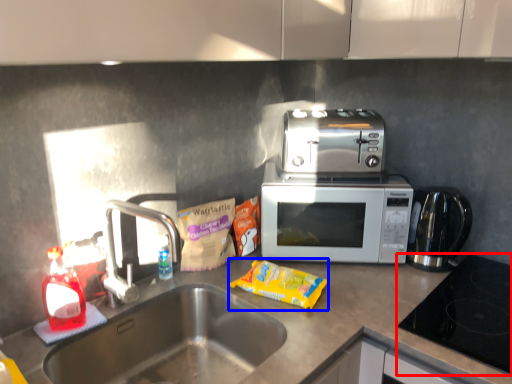
Question: Which point is closer to the camera, gas stove (highlighted by a red box) or snack (highlighted by a blue box)?

Choices:
 (A) gas stove
 (B) snack

Answer: (A)